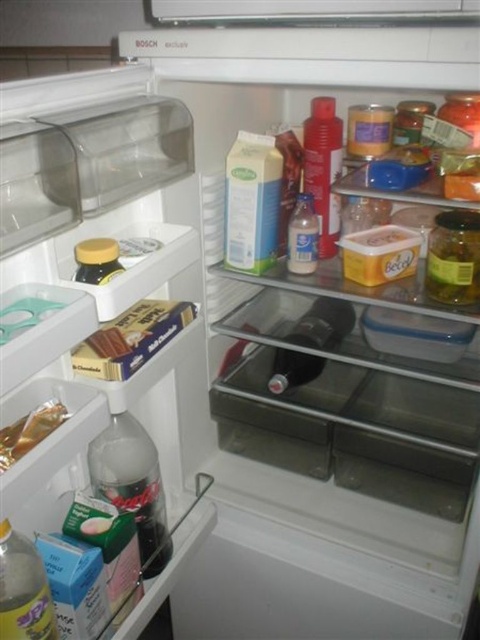
You are organizing the fridge and need to place a new item that requires more space than the existing items. Which item between the gold foil packet at lower left and the translucent plastic bottle at center would you choose to replace to accommodate the new item?

The gold foil packet at lower left has a larger size compared to the translucent plastic bottle at center, so replacing the gold foil packet at lower left would free up more space for the new item.

You are organizing the fridge and need to place a new item that requires a space wider than the translucent plastic bottle at center. Can the space next to the matte yellow lid at left accommodate it?

The translucent plastic bottle at center is narrower than the matte yellow lid at left, so the space next to the matte yellow lid at left is wider and can accommodate the new item.

From the picture: You are organizing your Bosch refrigerator and need to place a new item in the lower left corner. However, there is already an item there. What is the exact 2D coordinate of the gold foil packet at lower left that is blocking the space?

The gold foil packet at lower left is located at the 2D coordinate point of (29, 432).